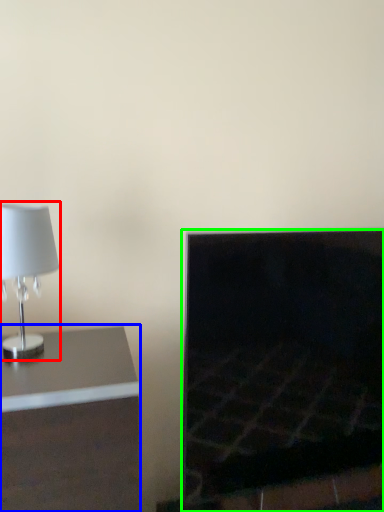
Question: Considering the real-world distances, which object is farthest from lamp (highlighted by a red box)? furniture (highlighted by a blue box) or fireplace (highlighted by a green box)?

Choices:
 (A) furniture
 (B) fireplace

Answer: (B)